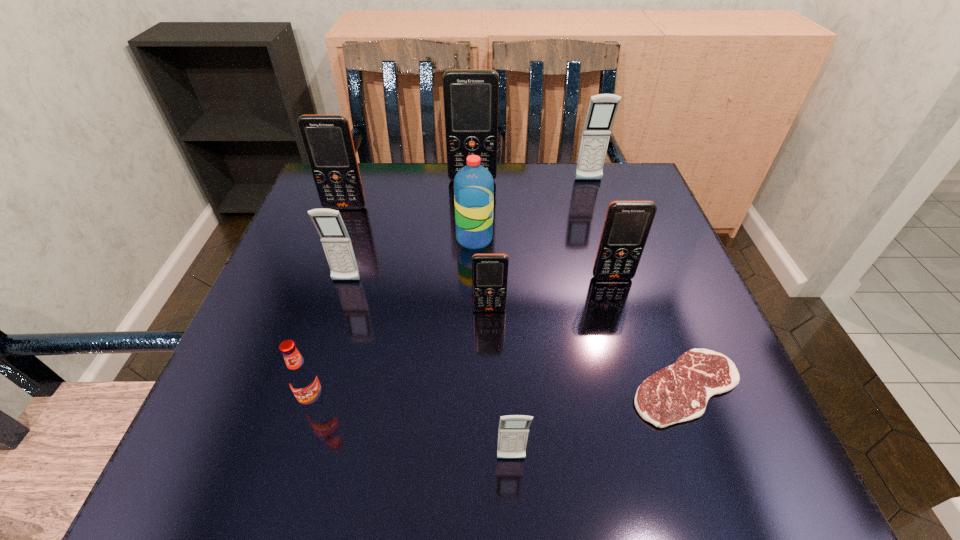
The image size is (960, 540). I want to click on vacant space located 0.210m on the front-facing side of the farthest gray cellular telephone, so click(x=607, y=238).

The image size is (960, 540). I want to click on free space located 0.360m on the screen of the leftmost orange cellular telephone, so click(x=299, y=335).

The height and width of the screenshot is (540, 960). Identify the location of free spot located on the front label of the fourth farthest object. click(664, 239).

Identify the location of vacant space situated on the front-facing side of the second biggest gray cellular telephone. (328, 340).

Locate an element on the screen. free point located on the screen of the rightmost orange cellular telephone is located at coordinates (628, 330).

Image resolution: width=960 pixels, height=540 pixels. In order to click on blank space located 0.360m on the right of the root beer in this screenshot , I will do `click(563, 402)`.

At what (x,y) coordinates should I click in order to perform the action: click on free space located 0.150m on the screen of the second nearest cellular telephone. Please return your answer as a coordinate pair (x, y). This screenshot has width=960, height=540. Looking at the image, I should click on (491, 385).

Find the location of a particular element. free location located on the back of the shortest object is located at coordinates (632, 243).

Image resolution: width=960 pixels, height=540 pixels. Find the location of `cellular telephone situated at the near edge`. cellular telephone situated at the near edge is located at coordinates (513, 430).

The height and width of the screenshot is (540, 960). Identify the location of steak that is at the near edge. (680, 392).